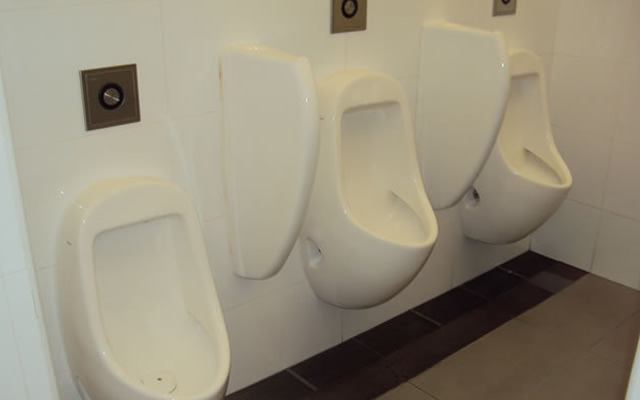
In order to click on right wall tiles in this screenshot , I will do `click(569, 233)`, `click(608, 248)`, `click(588, 169)`, `click(623, 178)`, `click(589, 96)`, `click(628, 109)`, `click(586, 35)`, `click(623, 45)`.